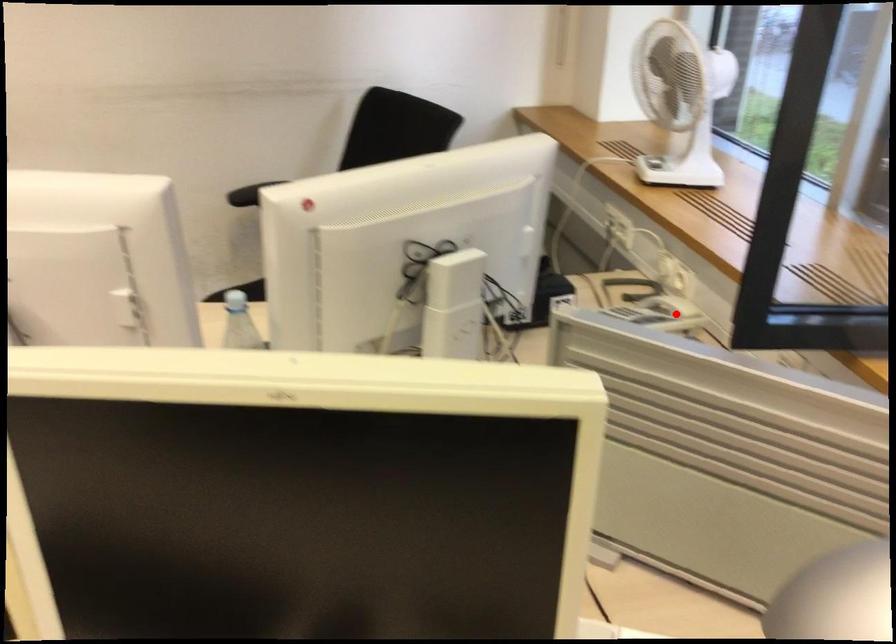
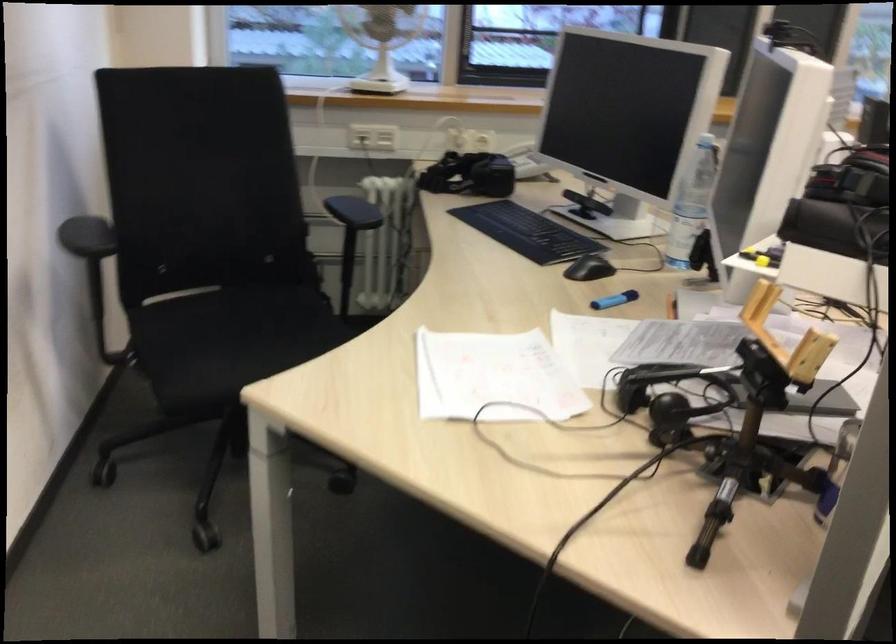
Question: I am providing you with two images of the same scene from different viewpoints. A red point is shown in image1. For the corresponding object point in image2, is it positioned nearer or farther from the camera?

Choices:
 (A) Nearer
 (B) Farther

Answer: (B)